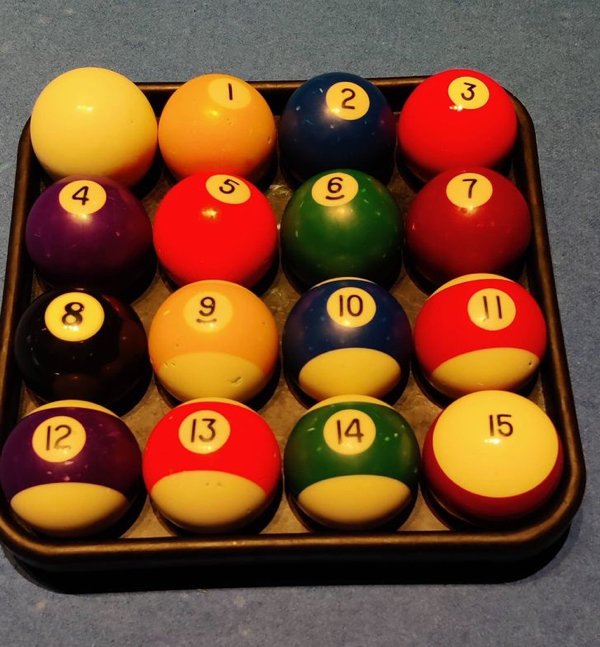
The height and width of the screenshot is (647, 600). What are the coordinates of `curved tray corner` in the screenshot? It's located at pyautogui.click(x=550, y=518), pyautogui.click(x=21, y=540), pyautogui.click(x=524, y=107).